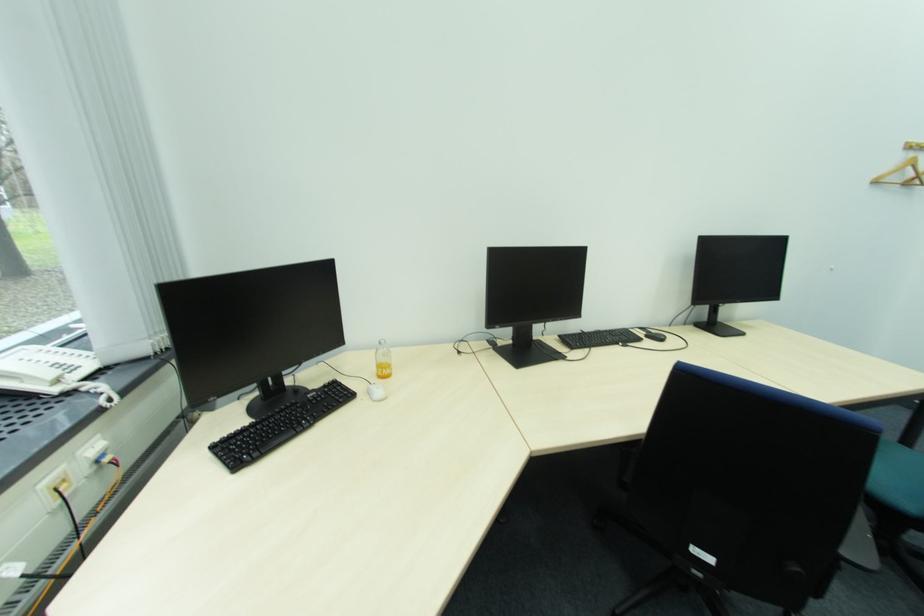
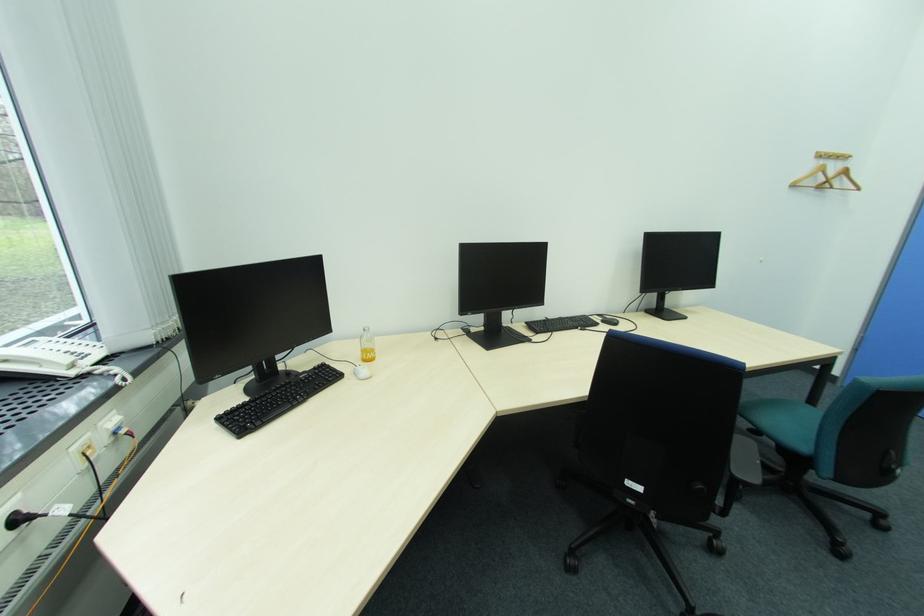
Question: How did the camera likely rotate?

Choices:
 (A) Left
 (B) Right
 (C) Up
 (D) Down

Answer: (B)